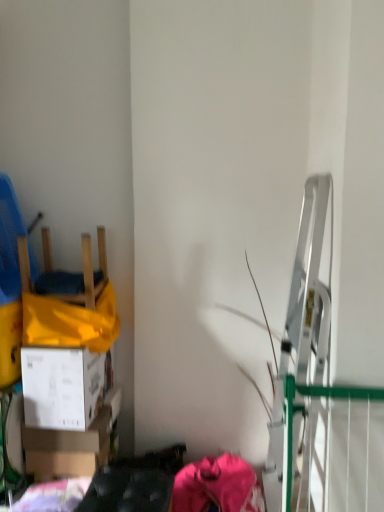
Question: Are white cardboard box at lower left, which appears as the 1th box when viewed from the top, and pink fabric at lower center beside each other?

Choices:
 (A) yes
 (B) no

Answer: (B)

Question: Considering the relative sizes of white cardboard box at lower left, which appears as the 1th box when viewed from the top, and pink fabric at lower center in the image provided, is white cardboard box at lower left, which appears as the 1th box when viewed from the top, wider than pink fabric at lower center?

Choices:
 (A) no
 (B) yes

Answer: (A)

Question: Does white cardboard box at lower left, placed as the second box when sorted from bottom to top, have a lesser height compared to pink fabric at lower center?

Choices:
 (A) no
 (B) yes

Answer: (B)

Question: Is there a large distance between white cardboard box at lower left, which appears as the 1th box when viewed from the top, and pink fabric at lower center?

Choices:
 (A) yes
 (B) no

Answer: (B)

Question: Can you confirm if white cardboard box at lower left, which appears as the 1th box when viewed from the top, is bigger than pink fabric at lower center?

Choices:
 (A) yes
 (B) no

Answer: (B)

Question: Is white cardboard box at lower left, placed as the second box when sorted from bottom to top, at the left side of pink fabric at lower center?

Choices:
 (A) yes
 (B) no

Answer: (A)

Question: From a real-world perspective, is pink fabric at lower center beneath wooden chair at left?

Choices:
 (A) no
 (B) yes

Answer: (B)

Question: Is pink fabric at lower center closer to camera compared to wooden chair at left?

Choices:
 (A) yes
 (B) no

Answer: (A)

Question: From a real-world perspective, is pink fabric at lower center on top of wooden chair at left?

Choices:
 (A) no
 (B) yes

Answer: (A)

Question: Does pink fabric at lower center have a greater width compared to wooden chair at left?

Choices:
 (A) yes
 (B) no

Answer: (A)

Question: Can you confirm if pink fabric at lower center is positioned to the left of wooden chair at left?

Choices:
 (A) no
 (B) yes

Answer: (A)

Question: From the image's perspective, would you say pink fabric at lower center is shown under wooden chair at left?

Choices:
 (A) no
 (B) yes

Answer: (B)

Question: Does white cardboard box at lower left, arranged as the second box when viewed from the top, turn towards white cardboard box at lower left, which appears as the 1th box when viewed from the top?

Choices:
 (A) no
 (B) yes

Answer: (A)